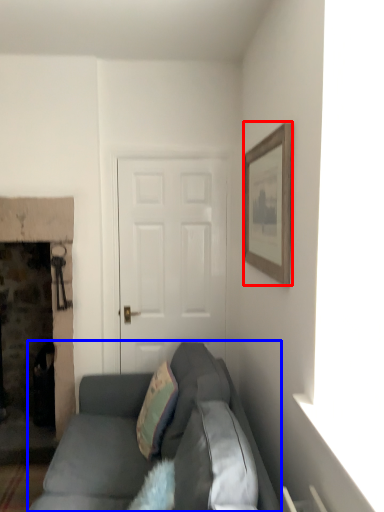
Question: Which of the following is the closest to the observer, picture frame (highlighted by a red box) or studio couch (highlighted by a blue box)?

Choices:
 (A) picture frame
 (B) studio couch

Answer: (B)